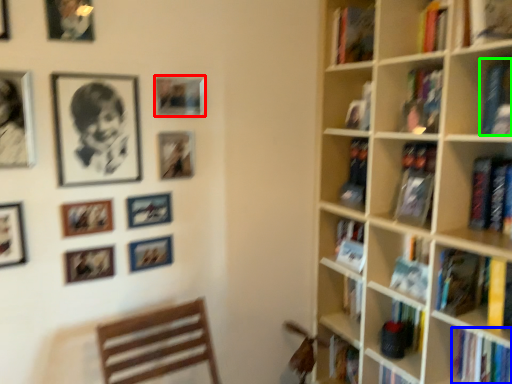
Question: Which is farther away from picture frame (highlighted by a red box)? book (highlighted by a blue box) or book (highlighted by a green box)?

Choices:
 (A) book
 (B) book

Answer: (A)